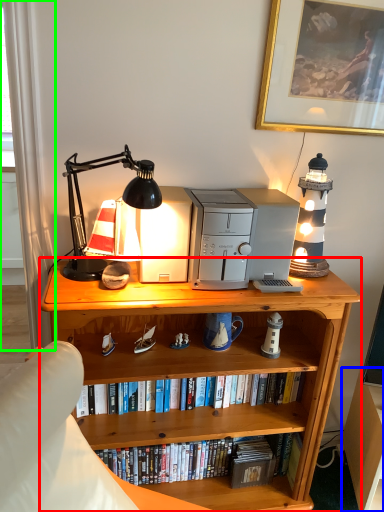
Question: Considering the real-world distances, which object is farthest from bookcase (highlighted by a red box)? computer desk (highlighted by a blue box) or curtain (highlighted by a green box)?

Choices:
 (A) computer desk
 (B) curtain

Answer: (B)